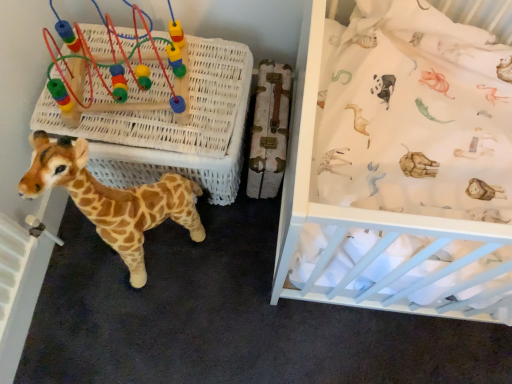
Find the location of a particular element. empty space that is ontop of white wicker basket at center (from a real-world perspective) is located at coordinates (141, 96).